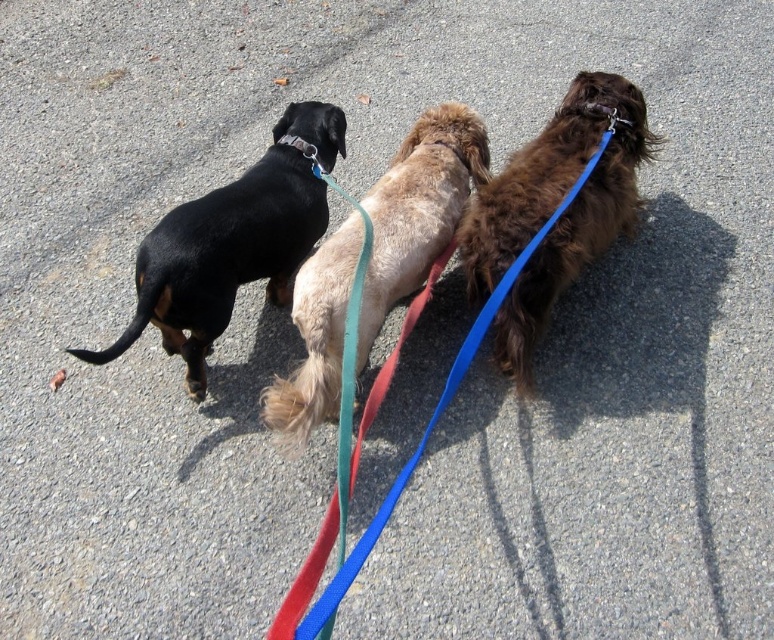
Question: Based on their relative distances, which object is farther from the black matte dog at left?

Choices:
 (A) blue fabric leash at center
 (B) fuzzy beige dog at center
 (C) metallic silver neckband at upper center

Answer: (A)

Question: Does brown fuzzy dog at right have a lesser width compared to black matte dog at left?

Choices:
 (A) no
 (B) yes

Answer: (B)

Question: Where is fuzzy beige dog at center located in relation to blue fabric leash at center in the image?

Choices:
 (A) left
 (B) right

Answer: (A)

Question: Which object is the farthest from the blue fabric leash at center?

Choices:
 (A) fuzzy beige dog at center
 (B) metallic silver neckband at upper center

Answer: (B)

Question: Which point is farther to the camera?

Choices:
 (A) blue fabric leash at center
 (B) black matte dog at left

Answer: (B)

Question: Is black matte dog at left closer to the viewer compared to metallic silver neckband at upper center?

Choices:
 (A) no
 (B) yes

Answer: (B)